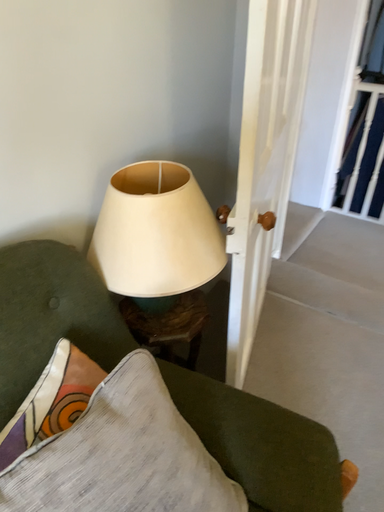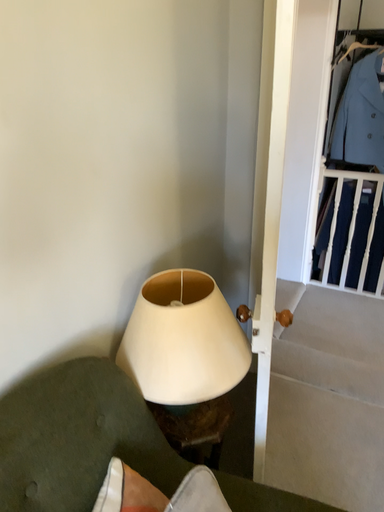
Question: Which way did the camera rotate in the video?

Choices:
 (A) rotated upward
 (B) rotated downward

Answer: (A)